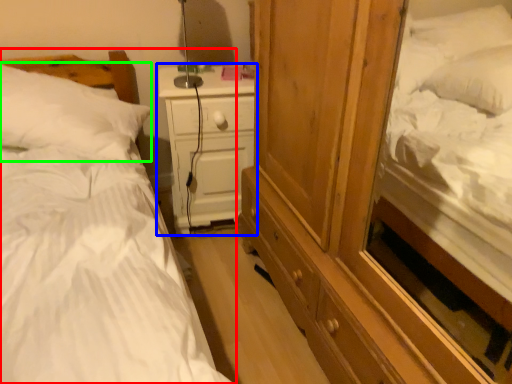
Question: Which object is positioned closest to bed (highlighted by a red box)? Select from nightstand (highlighted by a blue box) and pillow (highlighted by a green box).

Choices:
 (A) nightstand
 (B) pillow

Answer: (B)